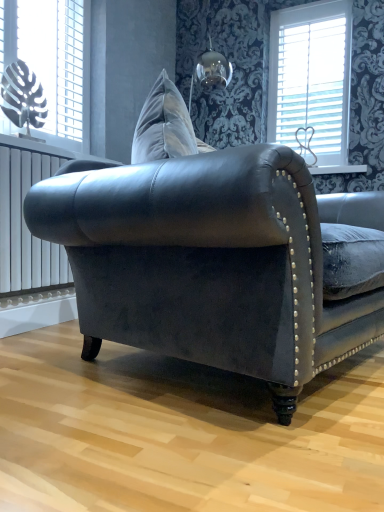
Question: From a real-world perspective, is white metallic radiator at left positioned under white plastic monstera leaf at upper left, which appears as the first window when viewed from the front, based on gravity?

Choices:
 (A) no
 (B) yes

Answer: (B)

Question: Is white metallic radiator at left oriented away from white plastic monstera leaf at upper left, which is counted as the second window, starting from the back?

Choices:
 (A) no
 (B) yes

Answer: (A)

Question: Can you confirm if white metallic radiator at left is bigger than white plastic monstera leaf at upper left, which is the second window in right-to-left order?

Choices:
 (A) no
 (B) yes

Answer: (B)

Question: Considering the relative sizes of white metallic radiator at left and white plastic monstera leaf at upper left, the 1th window in the left-to-right sequence, in the image provided, is white metallic radiator at left shorter than white plastic monstera leaf at upper left, the 1th window in the left-to-right sequence,?

Choices:
 (A) no
 (B) yes

Answer: (B)

Question: Considering the relative positions of white metallic radiator at left and white plastic monstera leaf at upper left, the 1th window in the left-to-right sequence, in the image provided, is white metallic radiator at left to the right of white plastic monstera leaf at upper left, the 1th window in the left-to-right sequence, from the viewer's perspective?

Choices:
 (A) no
 (B) yes

Answer: (B)

Question: From the image's perspective, is velvet dark gray couch at center located above or below white plastic monstera leaf at upper left, the 1th window in the left-to-right sequence?

Choices:
 (A) below
 (B) above

Answer: (A)

Question: Which is correct: velvet dark gray couch at center is inside white plastic monstera leaf at upper left, which is counted as the second window, starting from the back, or outside of it?

Choices:
 (A) outside
 (B) inside

Answer: (A)

Question: Looking at their shapes, would you say velvet dark gray couch at center is wider or thinner than white plastic monstera leaf at upper left, which appears as the first window when viewed from the front?

Choices:
 (A) thin
 (B) wide

Answer: (B)

Question: Is velvet dark gray couch at center bigger or smaller than white plastic monstera leaf at upper left, which is counted as the second window, starting from the back?

Choices:
 (A) small
 (B) big

Answer: (B)

Question: From their relative heights in the image, would you say white metallic radiator at left is taller or shorter than velvet dark gray couch at center?

Choices:
 (A) tall
 (B) short

Answer: (B)

Question: From a real-world perspective, is white metallic radiator at left above or below velvet dark gray couch at center?

Choices:
 (A) below
 (B) above

Answer: (B)

Question: From the image's perspective, is white metallic radiator at left located above or below velvet dark gray couch at center?

Choices:
 (A) below
 (B) above

Answer: (B)

Question: Is point click(x=0, y=201) closer or farther from the camera than point click(x=246, y=181)?

Choices:
 (A) closer
 (B) farther

Answer: (B)

Question: Considering the relative positions of white glossy window sill at upper center and white plastic monstera leaf at upper left, the 1th window in the left-to-right sequence, in the image provided, is white glossy window sill at upper center to the left or to the right of white plastic monstera leaf at upper left, the 1th window in the left-to-right sequence,?

Choices:
 (A) right
 (B) left

Answer: (A)

Question: From the image's perspective, relative to white plastic monstera leaf at upper left, the 1th window in the left-to-right sequence, is white glossy window sill at upper center above or below?

Choices:
 (A) below
 (B) above

Answer: (A)